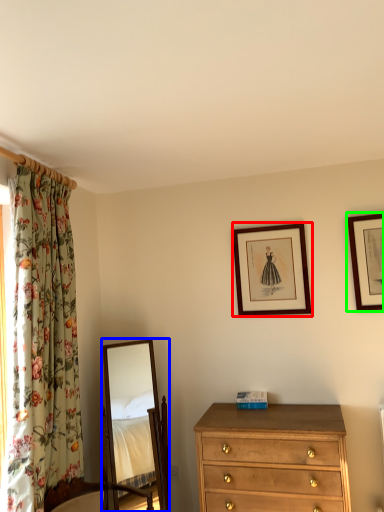
Question: Which object is positioned farthest from picture frame (highlighted by a red box)? Select from mirror (highlighted by a blue box) and picture frame (highlighted by a green box).

Choices:
 (A) mirror
 (B) picture frame

Answer: (A)